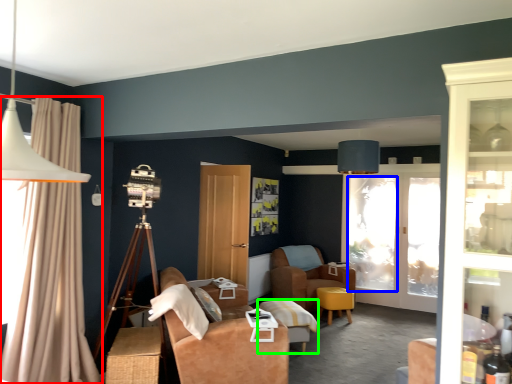
Question: Which object is the closest to the curtain (highlighted by a red box)? Choose among these: window screen (highlighted by a blue box) or table (highlighted by a green box).

Choices:
 (A) window screen
 (B) table

Answer: (B)